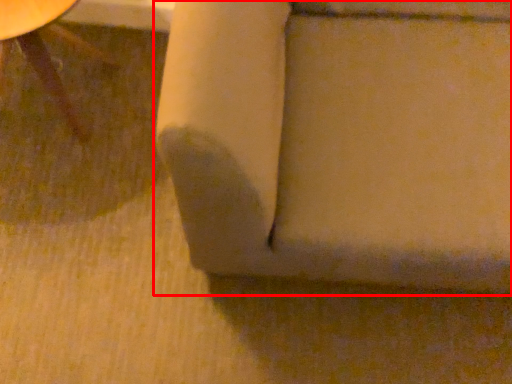
Question: From the image's perspective, considering the relative positions of furniture (annotated by the red box) and furniture in the image provided, where is furniture (annotated by the red box) located with respect to the staircase?

Choices:
 (A) below
 (B) above

Answer: (A)